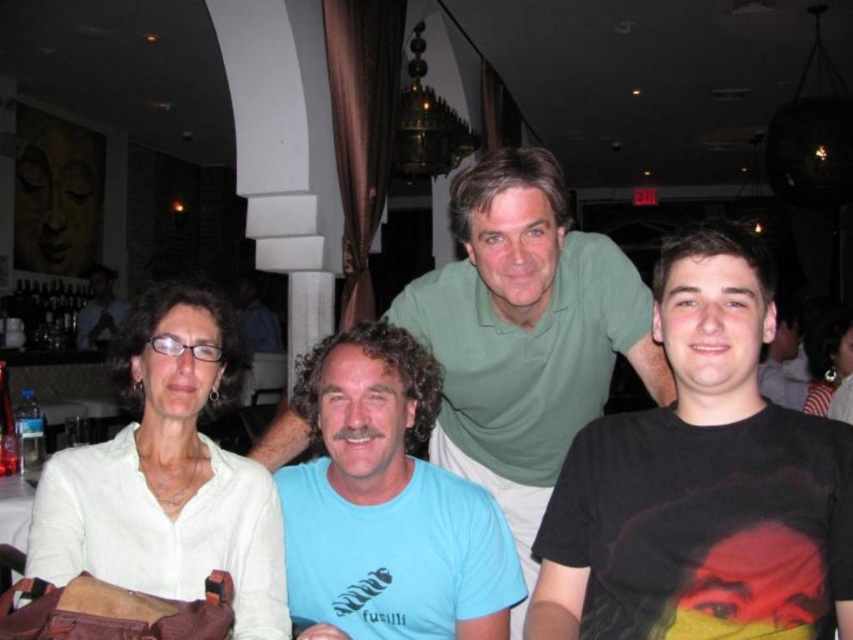
Can you confirm if black matte t-shirt at right is positioned above blue cotton t-shirt at center?

Yes, black matte t-shirt at right is above blue cotton t-shirt at center.

Is black matte t-shirt at right taller than blue cotton t-shirt at center?

Result: Yes.

What do you see at coordinates (701, 483) in the screenshot? I see `black matte t-shirt at right` at bounding box center [701, 483].

Find the location of `black matte t-shirt at right`. black matte t-shirt at right is located at coordinates (701, 483).

Can you confirm if blue cotton t-shirt at center is smaller than black matte t-shirt at upper right?

Yes, blue cotton t-shirt at center is smaller than black matte t-shirt at upper right.

The width and height of the screenshot is (853, 640). What are the coordinates of `blue cotton t-shirt at center` in the screenshot? It's located at (387, 504).

The width and height of the screenshot is (853, 640). Find the location of `blue cotton t-shirt at center`. blue cotton t-shirt at center is located at coordinates (387, 504).

Can you confirm if green cotton shirt at upper center is shorter than blue cotton t-shirt at center?

In fact, green cotton shirt at upper center may be taller than blue cotton t-shirt at center.

Who is more forward, [473,344] or [447,502]?

Point [447,502] is in front.

Does point (292, 413) come behind point (376, 387)?

Yes, it is behind point (376, 387).

Image resolution: width=853 pixels, height=640 pixels. Identify the location of green cotton shirt at upper center. (525, 333).